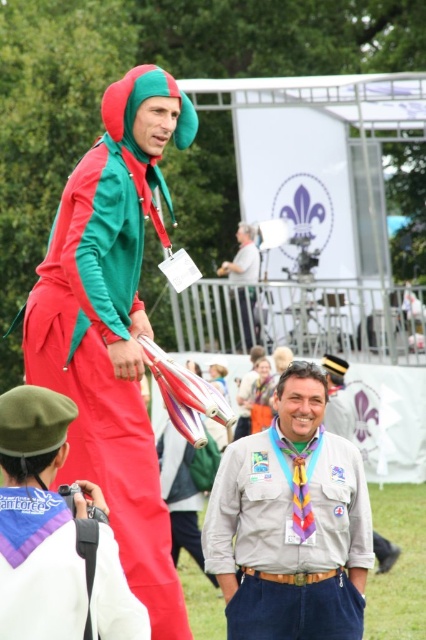
You are standing at the point labeled point (129, 77) and want to walk to the point labeled point (342, 573). Which direction should you move to get closer to your destination?

You should move towards the direction away from the viewer since point (342, 573) is further away than point (129, 77).

In the scene shown: What is the color of the shirt worn by the person at the coordinates point (290, 524)?

The khaki cotton shirt at center is the color khaki.

You are a photographer trying to capture a group photo of the khaki cotton shirt at center and the matte green and red jumpsuit at center. Which person should you position closer to the front to ensure both are visible in the photo?

You should position the matte green and red jumpsuit at center closer to the front because the khaki cotton shirt at center is taller, so placing the shorter individual in front will help balance visibility in the photo.